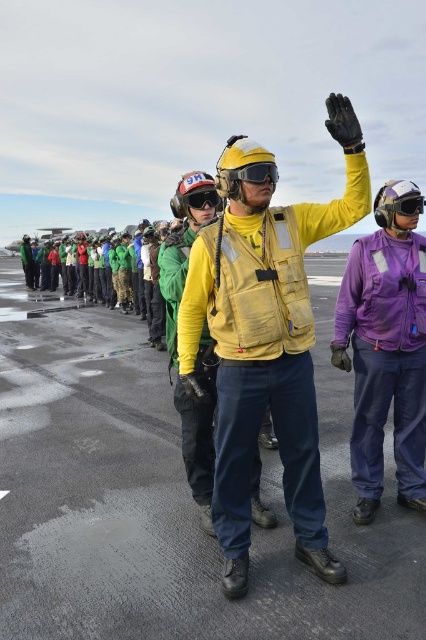
Question: Which of the following is the farthest from the observer?

Choices:
 (A) (275, 172)
 (B) (186, 611)
 (C) (218, 196)
 (D) (388, 205)

Answer: (C)

Question: Where is glossy asphalt tarmac at center located in relation to black matte goggles at center in the image?

Choices:
 (A) left
 (B) right

Answer: (A)

Question: Does glossy asphalt tarmac at center appear on the left side of matte black goggles at center?

Choices:
 (A) yes
 (B) no

Answer: (A)

Question: Which of the following is the closest to the observer?

Choices:
 (A) matte black goggles at upper right
 (B) glossy asphalt tarmac at center

Answer: (B)

Question: Considering the relative positions of glossy asphalt tarmac at center and yellow fabric vest at center in the image provided, where is glossy asphalt tarmac at center located with respect to yellow fabric vest at center?

Choices:
 (A) below
 (B) above

Answer: (A)

Question: Which of the following is the closest to the observer?

Choices:
 (A) matte black goggles at center
 (B) black matte goggles at center
 (C) yellow fabric vest at center
 (D) matte black goggles at upper right

Answer: (C)